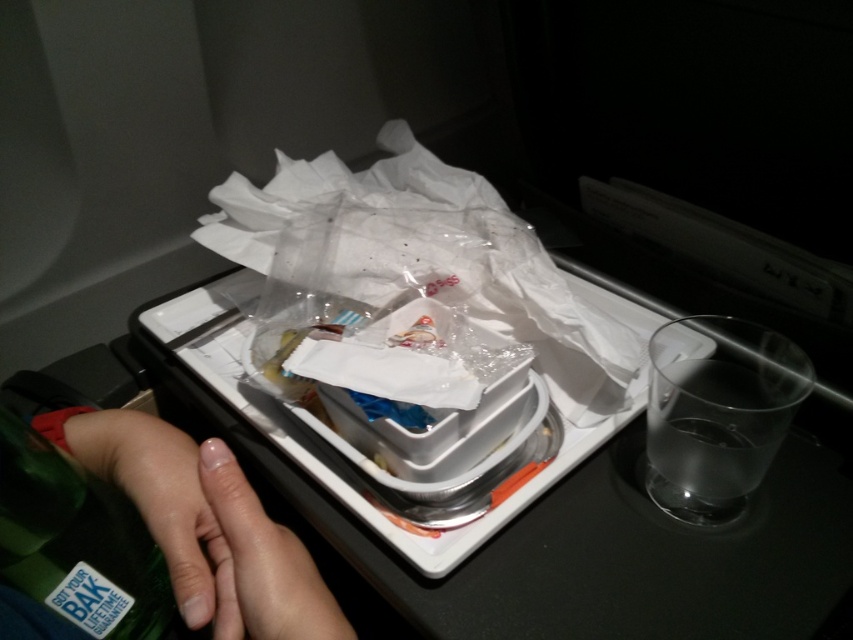
Question: Which object appears closest to the camera in this image?

Choices:
 (A) transparent plastic bag at center
 (B) skinsmoothhand at center
 (C) green matte bottle at lower left

Answer: (B)

Question: Can you confirm if skinsmoothhand at center is thinner than green matte bottle at lower left?

Choices:
 (A) no
 (B) yes

Answer: (A)

Question: Which object appears closest to the camera in this image?

Choices:
 (A) transparent plastic bag at center
 (B) skinsmoothhand at center
 (C) green matte bottle at lower left

Answer: (B)

Question: In this image, where is transparent plastic bag at center located relative to green matte bottle at lower left?

Choices:
 (A) below
 (B) above

Answer: (B)

Question: In this image, where is transparent plastic bag at center located relative to green matte bottle at lower left?

Choices:
 (A) below
 (B) above

Answer: (B)

Question: Based on their relative distances, which object is nearer to the skinsmoothhand at center?

Choices:
 (A) transparent plastic bag at center
 (B) green matte bottle at lower left

Answer: (B)